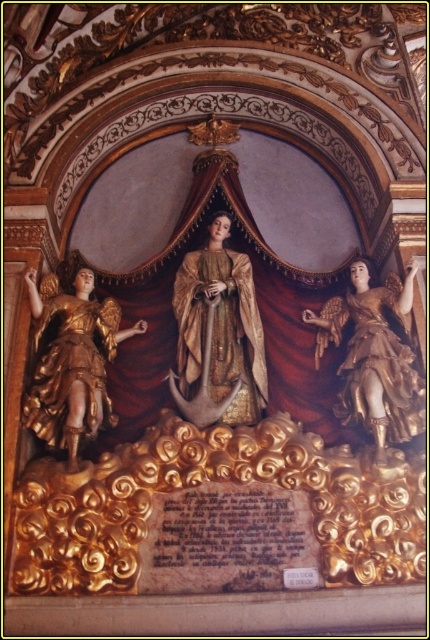
Who is taller, gold polished statue at left or gold/gilded statue at right?

With more height is gold/gilded statue at right.

Can you confirm if gold polished statue at left is positioned above gold/gilded statue at right?

No.

Who is more forward, (68,365) or (420,422)?

Positioned in front is point (420,422).

Identify the location of gold polished statue at left. (71, 362).

Does gold textured fabric at center appear on the right side of gold/gilded statue at right?

Incorrect, gold textured fabric at center is not on the right side of gold/gilded statue at right.

Locate an element on the screen. The image size is (430, 640). gold textured fabric at center is located at coordinates (218, 336).

Is gold textured fabric at center bigger than gold polished statue at left?

Yes.

Who is shorter, gold textured fabric at center or gold polished statue at left?

gold polished statue at left is shorter.

Is point (229, 381) farther from camera compared to point (67, 333)?

No, (229, 381) is in front of (67, 333).

This screenshot has height=640, width=430. I want to click on gold textured fabric at center, so click(218, 336).